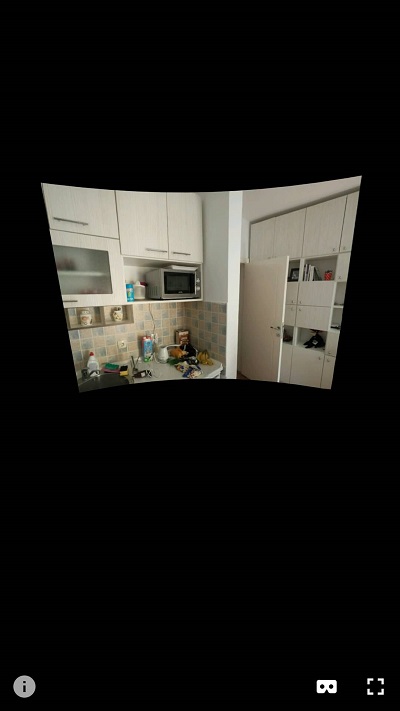
The image size is (400, 711). In order to click on beige and green tiled wall in this screenshot , I will do `click(205, 320)`.